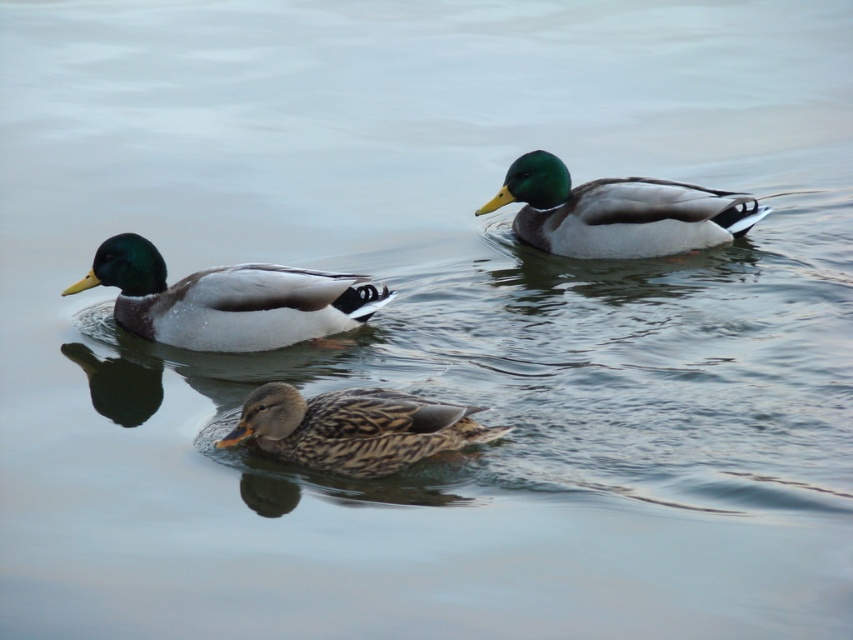
You are observing the ducks swimming in the water. Where is the green glossy duck at upper right positioned in relation to the other ducks?

The green glossy duck at upper right is located at point 0.333 on the horizontal axis and 0.725 on the vertical axis, which places it in the upper right area relative to the other ducks.

From the picture: You are observing ducks on a lake and see the green glossy duck at upper right and the brown speckled duck at center. Which duck is positioned higher in the image?

The green glossy duck at upper right is positioned higher in the image than the brown speckled duck at center.

You are a photographer trying to capture a closeup shot of the shiny brown duck at center and the green glossy duck at upper right. If your camera can only focus on one duck at a time, which duck should you choose to ensure the photo is in focus if you want the wider duck in the frame?

The shiny brown duck at center is wider than the green glossy duck at upper right, so you should focus on the shiny brown duck at center to capture the wider duck in focus.